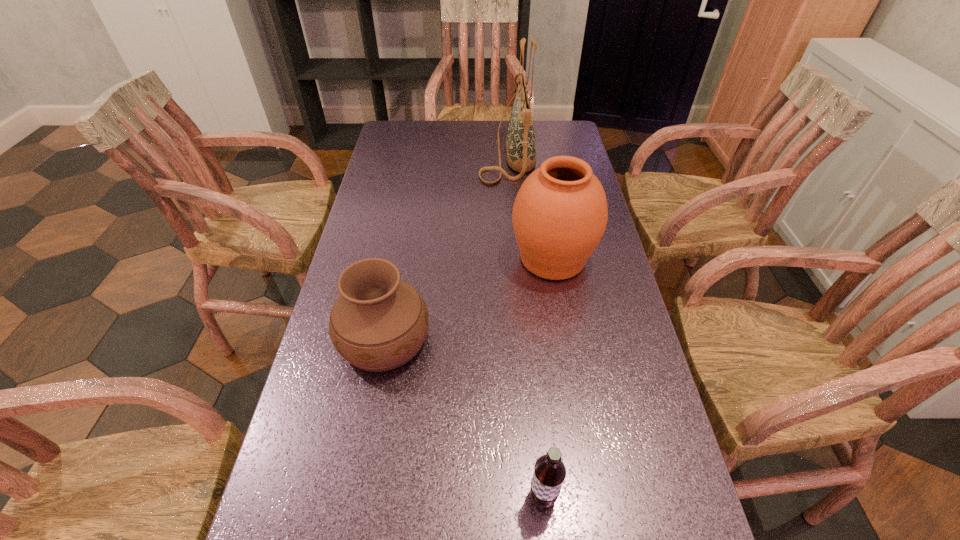
Identify which object is the third nearest to the handbag. Please provide its 2D coordinates. Your answer should be formatted as a tuple, i.e. [(x, y)], where the tuple contains the x and y coordinates of a point satisfying the conditions above.

[(549, 473)]

Choose which object is the third nearest neighbor to the farther urn. Please provide its 2D coordinates. Your answer should be formatted as a tuple, i.e. [(x, y)], where the tuple contains the x and y coordinates of a point satisfying the conditions above.

[(549, 473)]

In order to click on vacant region that satisfies the following two spatial constraints: 1. on the back side of the third farthest object; 2. on the right side of the taller urn in this screenshot , I will do `click(399, 259)`.

You are a GUI agent. You are given a task and a screenshot of the screen. Output one action in this format:
    pyautogui.click(x=<x>, y=<y>)
    Task: Click on the blank area in the image that satisfies the following two spatial constraints: 1. on the front-facing side of the farthest object; 2. on the left side of the nearest object
    This screenshot has height=540, width=960.
    Given the screenshot: What is the action you would take?
    pyautogui.click(x=534, y=497)

Where is `blank space that satisfies the following two spatial constraints: 1. on the front-facing side of the nearest object; 2. on the right side of the handbag`? The width and height of the screenshot is (960, 540). blank space that satisfies the following two spatial constraints: 1. on the front-facing side of the nearest object; 2. on the right side of the handbag is located at coordinates (534, 497).

Where is `free location that satisfies the following two spatial constraints: 1. on the back side of the right urn; 2. on the left side of the shorter urn`? This screenshot has height=540, width=960. free location that satisfies the following two spatial constraints: 1. on the back side of the right urn; 2. on the left side of the shorter urn is located at coordinates (399, 259).

Locate an element on the screen. free space that satisfies the following two spatial constraints: 1. on the front-facing side of the handbag; 2. on the right side of the taller urn is located at coordinates (516, 259).

Where is `free region that satisfies the following two spatial constraints: 1. on the front-facing side of the farthest object; 2. on the right side of the taller urn`? free region that satisfies the following two spatial constraints: 1. on the front-facing side of the farthest object; 2. on the right side of the taller urn is located at coordinates (516, 259).

Where is `free space that satisfies the following two spatial constraints: 1. on the back side of the root beer; 2. on the left side of the right urn`? The height and width of the screenshot is (540, 960). free space that satisfies the following two spatial constraints: 1. on the back side of the root beer; 2. on the left side of the right urn is located at coordinates (520, 259).

Locate an element on the screen. The height and width of the screenshot is (540, 960). vacant space that satisfies the following two spatial constraints: 1. on the front-facing side of the farther urn; 2. on the left side of the tallest object is located at coordinates (516, 259).